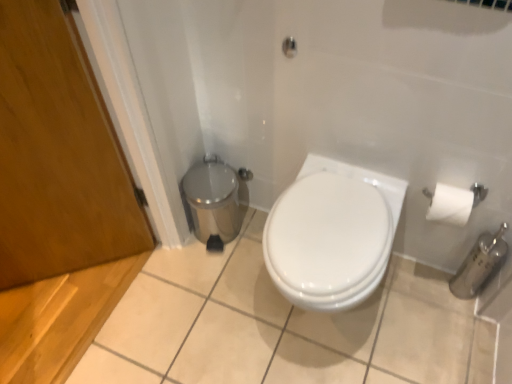
Question: Should I look upward or downward to see white glossy toilet at center?

Choices:
 (A) down
 (B) up

Answer: (A)

Question: Could you tell me if matte silver shower at upper center is turned towards polished stainless steel trash can at lower left?

Choices:
 (A) yes
 (B) no

Answer: (B)

Question: Is matte silver shower at upper center with polished stainless steel trash can at lower left?

Choices:
 (A) no
 (B) yes

Answer: (A)

Question: Is matte silver shower at upper center positioned far away from polished stainless steel trash can at lower left?

Choices:
 (A) yes
 (B) no

Answer: (B)

Question: Is matte silver shower at upper center positioned behind polished stainless steel trash can at lower left?

Choices:
 (A) no
 (B) yes

Answer: (A)

Question: Does matte silver shower at upper center come in front of polished stainless steel trash can at lower left?

Choices:
 (A) no
 (B) yes

Answer: (B)

Question: Does matte silver shower at upper center appear on the left side of polished stainless steel trash can at lower left?

Choices:
 (A) no
 (B) yes

Answer: (A)

Question: Is polished stainless steel trash can at lower left located outside white glossy toilet at center?

Choices:
 (A) no
 (B) yes

Answer: (B)

Question: Considering the relative sizes of polished stainless steel trash can at lower left and white glossy toilet at center in the image provided, is polished stainless steel trash can at lower left smaller than white glossy toilet at center?

Choices:
 (A) no
 (B) yes

Answer: (B)

Question: Does polished stainless steel trash can at lower left come in front of white glossy toilet at center?

Choices:
 (A) no
 (B) yes

Answer: (A)

Question: Is polished stainless steel trash can at lower left taller than white glossy toilet at center?

Choices:
 (A) yes
 (B) no

Answer: (B)

Question: From the image's perspective, is polished stainless steel trash can at lower left above white glossy toilet at center?

Choices:
 (A) yes
 (B) no

Answer: (A)

Question: Considering the relative sizes of polished stainless steel trash can at lower left and white glossy toilet at center in the image provided, is polished stainless steel trash can at lower left thinner than white glossy toilet at center?

Choices:
 (A) no
 (B) yes

Answer: (B)

Question: Considering the relative sizes of wooden door at left and matte silver shower at upper center in the image provided, is wooden door at left bigger than matte silver shower at upper center?

Choices:
 (A) yes
 (B) no

Answer: (A)